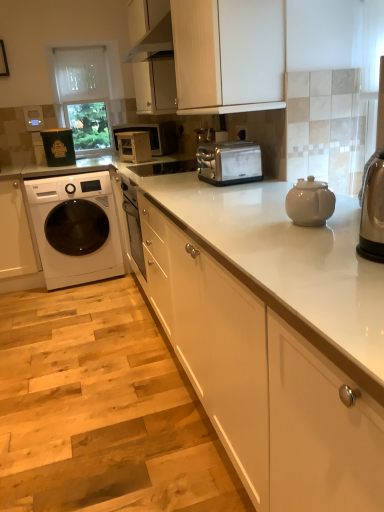
You are a GUI agent. You are given a task and a screenshot of the screen. Output one action in this format:
    pyautogui.click(x=<x>, y=<y>)
    Task: Click on the vacant space to the left of satin silver toaster at center
    This screenshot has height=512, width=384.
    Given the screenshot: What is the action you would take?
    pyautogui.click(x=181, y=186)